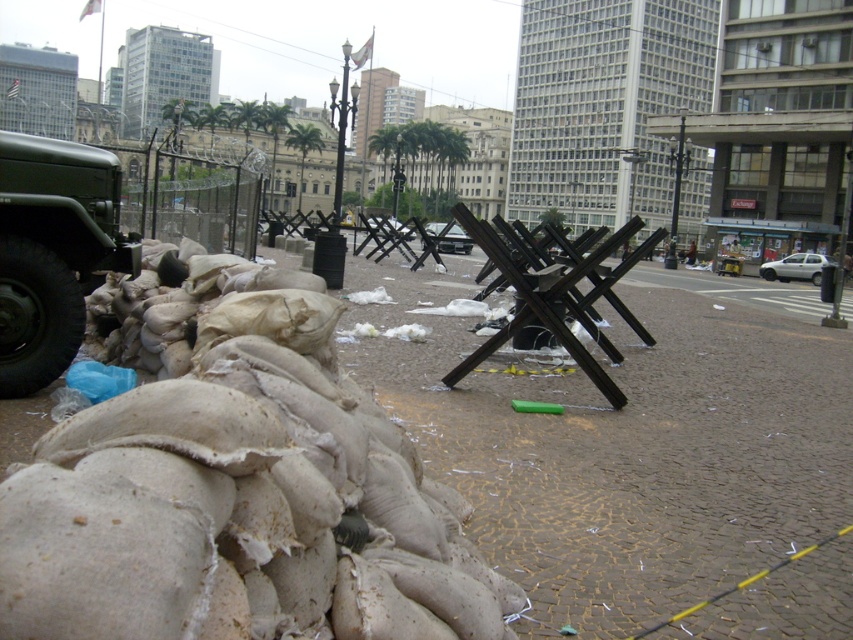
Can you confirm if matte green military vehicle at left is wider than metallic silver car at center?

No, matte green military vehicle at left is not wider than metallic silver car at center.

Is point (44, 298) more distant than point (459, 243)?

No.

Identify the location of matte green military vehicle at left. (51, 252).

Does matte green military vehicle at left appear under white matte car at right?

Indeed, matte green military vehicle at left is positioned under white matte car at right.

Does point (6, 323) come in front of point (770, 268)?

Yes, point (6, 323) is closer to viewer.

You are a GUI agent. You are given a task and a screenshot of the screen. Output one action in this format:
    pyautogui.click(x=<x>, y=<y>)
    Task: Click on the matte green military vehicle at left
    The image size is (853, 640).
    Given the screenshot: What is the action you would take?
    pyautogui.click(x=51, y=252)

Who is positioned more to the left, white matte car at right or metallic silver car at center?

metallic silver car at center is more to the left.

Is white matte car at right wider than metallic silver car at center?

Yes.

Between point (817, 260) and point (428, 227), which one is positioned behind?

Point (428, 227)

This screenshot has height=640, width=853. In order to click on white matte car at right in this screenshot , I will do `click(793, 268)`.